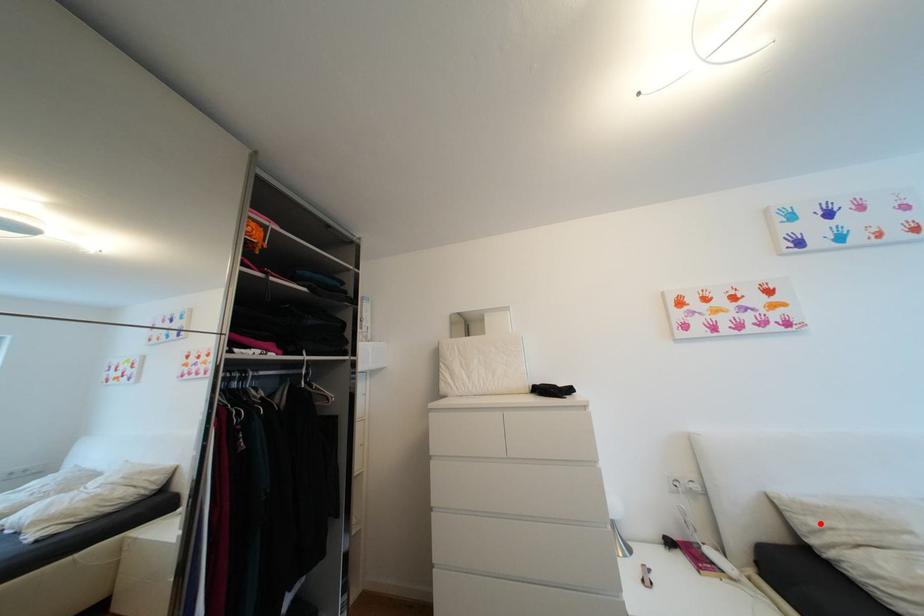
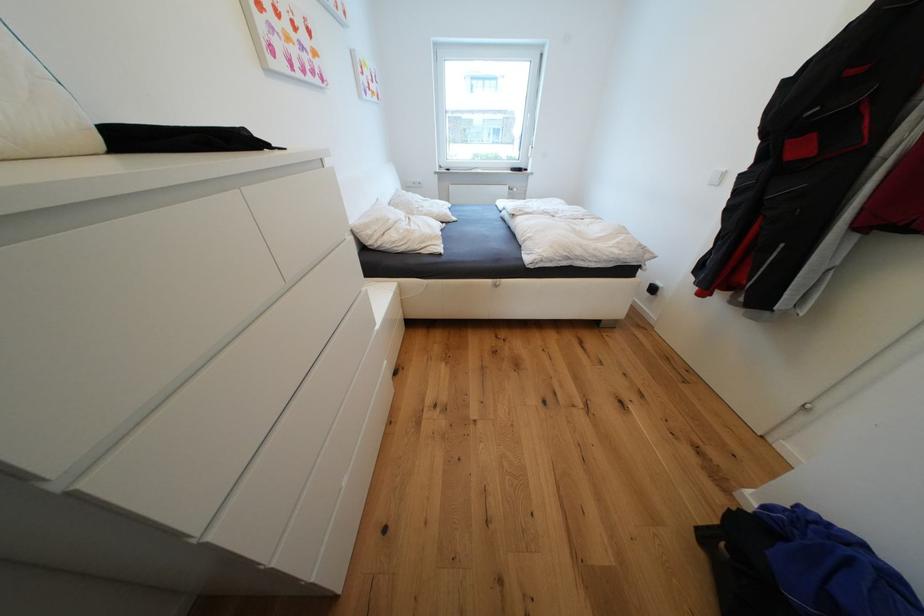
Where in the second image is the point corresponding to the highlighted location from the first image?

(377, 233)